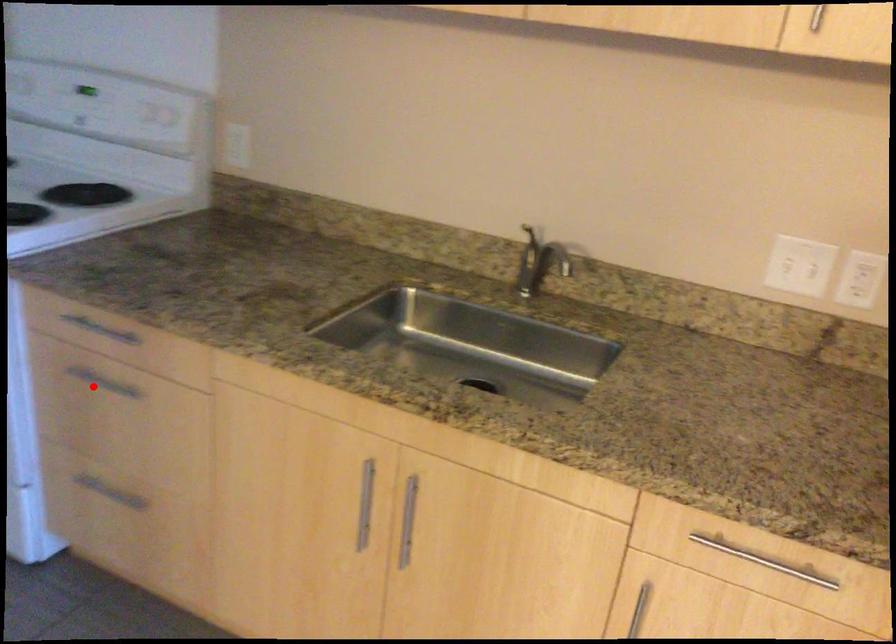
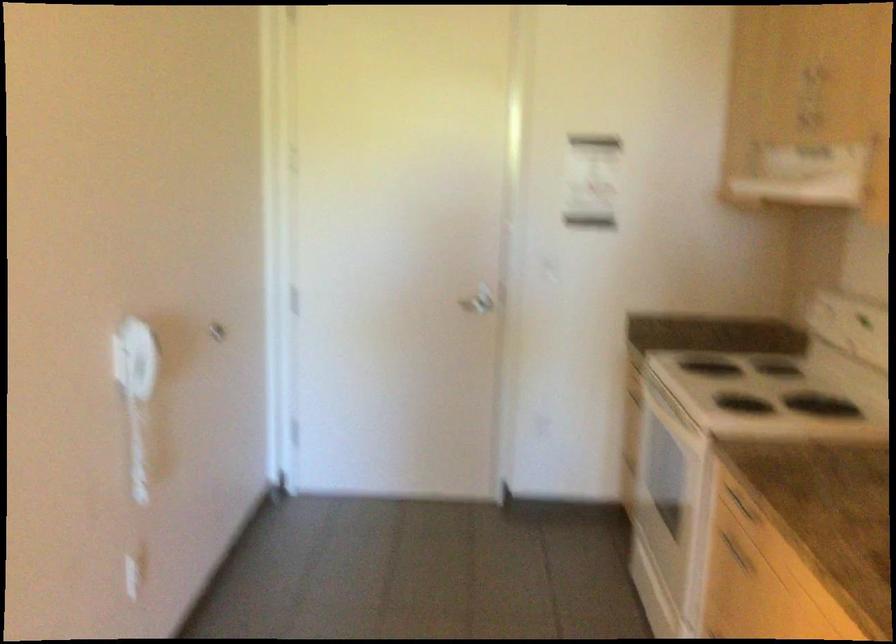
Question: I am providing you with two images of the same scene from different viewpoints. A red point is shown in image1. For the corresponding object point in image2, is it positioned nearer or farther from the camera?

Choices:
 (A) Nearer
 (B) Farther

Answer: (B)